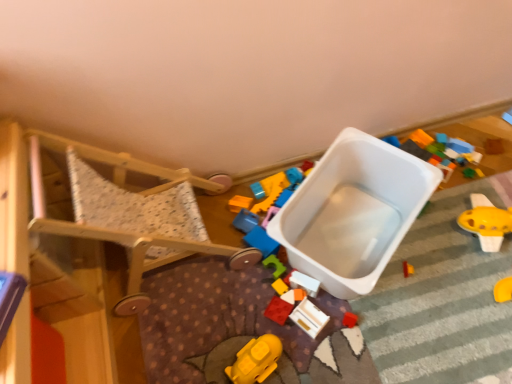
Find the location of a particular element. This screenshot has width=512, height=384. vacant space situated on the left part of rubberized red block at center, which appears as the fifth toy when viewed from the right is located at coordinates (220, 318).